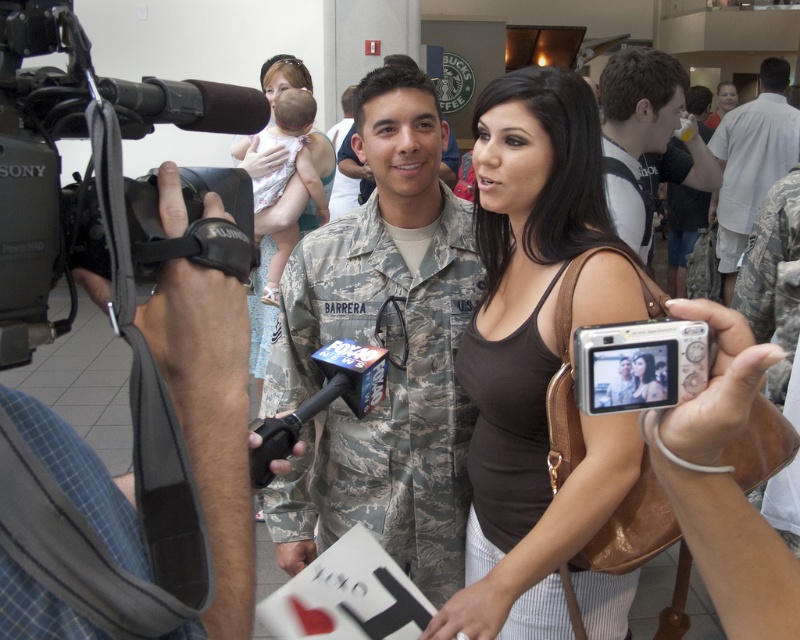
Based on the scene description, can you determine the spatial relationship between the camouflage fabric uniform at center and the black matte video camera at left? Please explain using the objects mentioned.

The camouflage fabric uniform at center is located to the right of the black matte video camera at left according to the description.

You are a photographer at the event and need to position your camera to capture both the camouflage fabric uniform at center and the brown fabric purse at center in the frame. Which object should you focus on first to ensure both are in focus, considering their sizes?

The camouflage fabric uniform at center is much taller than the brown fabric purse at center, so focusing on the larger object first will help ensure both are in focus.

You are a photographer at the event and need to position your equipment so that the camouflage fabric uniform at center is visible above the black matte video camera at left. Is this possible based on their sizes?

The camouflage fabric uniform at center is taller than the black matte video camera at left, so yes, positioning the equipment so the uniform is visible above the camera is possible.